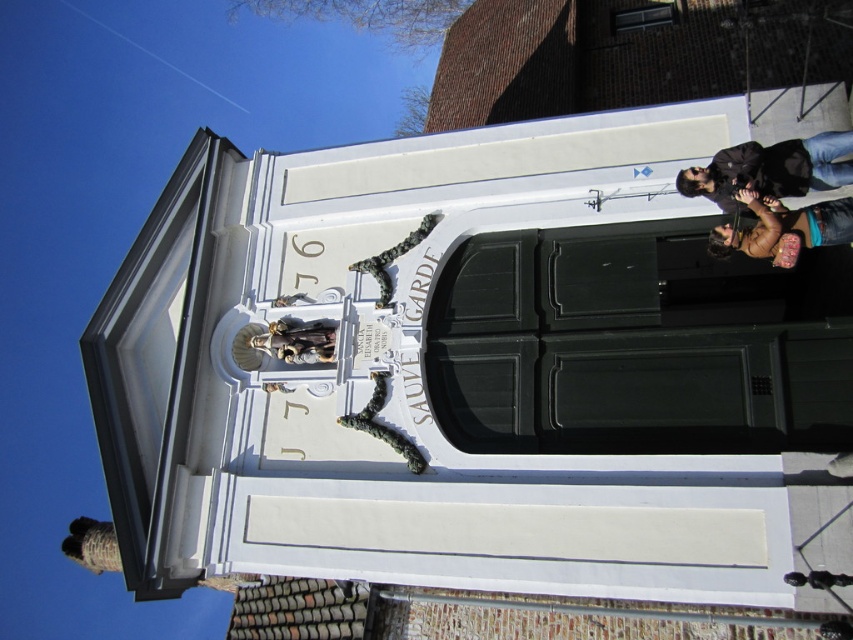
You are a visitor standing in front of the building and notice two jackets hanging on a rack near the entrance. The black leather jacket at upper right and the brown leather jacket at upper right. Which jacket is placed higher on the rack?

The black leather jacket at upper right is positioned over the brown leather jacket at upper right, so it is placed higher on the rack.

You are standing in front of the building described in the scene. Where is the black leather jacket at upper right located?

The black leather jacket at upper right is located at point (770, 170).